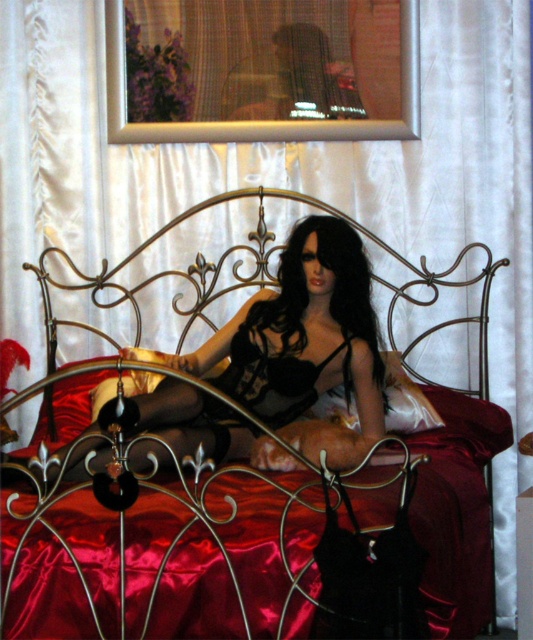
You are standing in the room and want to touch the metallic gold bed at center and the gold wrought iron headboard at center. Which one can you reach first without moving your position?

The metallic gold bed at center is closer to the viewer than the gold wrought iron headboard at center, so you can reach the metallic gold bed at center first without moving your position.

You are a photographer setting up a shoot in this room. You need to position a light to the right of the metallic gold bed at center. Will the light be to the right or left of the satin black lingerie at center?

The satin black lingerie at center is to the left of the metallic gold bed at center. Positioning the light to the right of the metallic gold bed at center would place it to the right of the satin black lingerie at center as well.